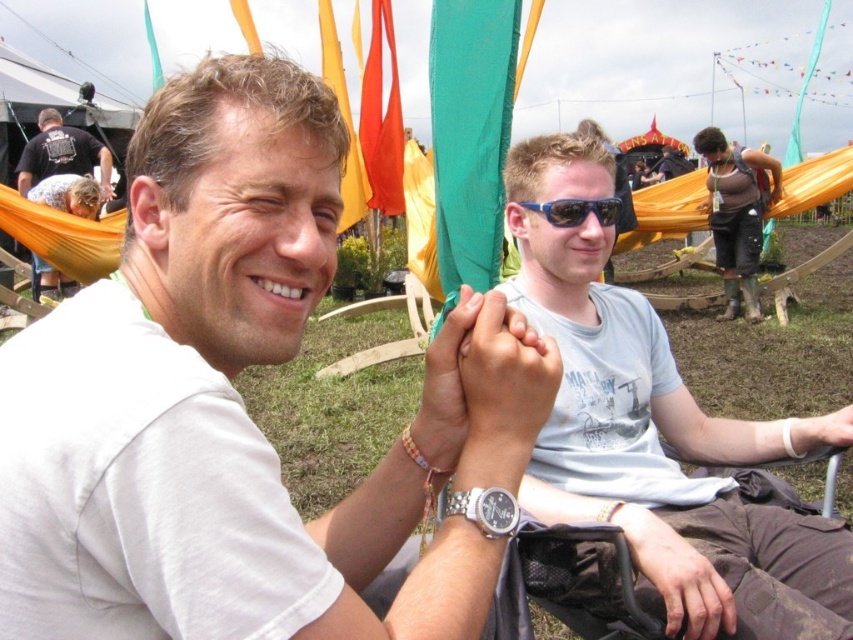
Question: Among these points, which one is nearest to the camera?

Choices:
 (A) (601, 257)
 (B) (253, 144)

Answer: (B)

Question: Which object is the farthest from the light blue cotton t-shirt at center?

Choices:
 (A) blue plastic sunglasses at upper center
 (B) white matte t-shirt at center

Answer: (B)

Question: Does light blue cotton t-shirt at center appear over blue plastic sunglasses at upper center?

Choices:
 (A) yes
 (B) no

Answer: (B)

Question: Is the position of light blue cotton t-shirt at center more distant than that of black t-shirt at upper left?

Choices:
 (A) yes
 (B) no

Answer: (B)

Question: Is light blue cotton t-shirt at center thinner than blue plastic sunglasses at upper center?

Choices:
 (A) no
 (B) yes

Answer: (A)

Question: Which of the following is the farthest from the observer?

Choices:
 (A) white matte t-shirt at center
 (B) light blue cotton t-shirt at center
 (C) black t-shirt at upper left
 (D) blue plastic sunglasses at upper center

Answer: (C)